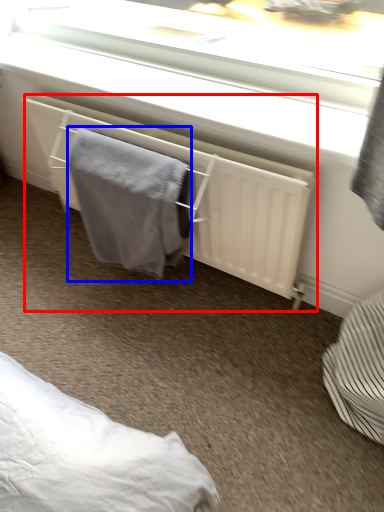
Question: Among these objects, which one is farthest to the camera, radiator (highlighted by a red box) or bath towel (highlighted by a blue box)?

Choices:
 (A) radiator
 (B) bath towel

Answer: (B)